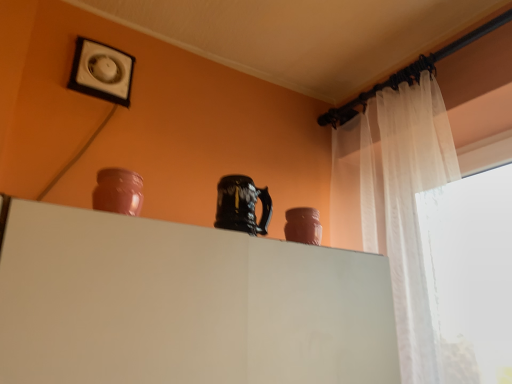
Question: Is matte pink vase at right, which is the 2th vase in front-to-back order, to the right of matte clay vase at upper left, which appears as the second vase when viewed from the back, from the viewer's perspective?

Choices:
 (A) yes
 (B) no

Answer: (A)

Question: Does matte pink vase at right, acting as the 2th vase starting from the top, come in front of matte clay vase at upper left, marked as the 2th vase in a bottom-to-top arrangement?

Choices:
 (A) no
 (B) yes

Answer: (A)

Question: Can you confirm if matte pink vase at right, the 1th vase when ordered from right to left, is shorter than matte clay vase at upper left, which appears as the second vase when viewed from the back?

Choices:
 (A) no
 (B) yes

Answer: (B)

Question: Is matte pink vase at right, which is counted as the 1th vase, starting from the back, not within matte clay vase at upper left, which appears as the second vase when viewed from the back?

Choices:
 (A) yes
 (B) no

Answer: (A)

Question: Is the depth of matte pink vase at right, acting as the 2th vase starting from the top, greater than that of matte clay vase at upper left, which appears as the second vase when viewed from the right?

Choices:
 (A) no
 (B) yes

Answer: (B)

Question: From a real-world perspective, is white glossy vent at upper left physically located above or below matte clay vase at upper left, the first vase when ordered from front to back?

Choices:
 (A) above
 (B) below

Answer: (A)

Question: Is white glossy vent at upper left bigger or smaller than matte clay vase at upper left, which ranks as the 1th vase in left-to-right order?

Choices:
 (A) small
 (B) big

Answer: (B)

Question: Is white glossy vent at upper left taller or shorter than matte clay vase at upper left, the first vase when ordered from front to back?

Choices:
 (A) short
 (B) tall

Answer: (B)

Question: Choose the correct answer: Is white glossy vent at upper left inside matte clay vase at upper left, which appears as the second vase when viewed from the right, or outside it?

Choices:
 (A) outside
 (B) inside

Answer: (A)

Question: Considering the positions of point (314, 243) and point (233, 175), is point (314, 243) closer or farther from the camera than point (233, 175)?

Choices:
 (A) farther
 (B) closer

Answer: (A)

Question: Is matte pink vase at right, arranged as the 1th vase when ordered from the bottom, to the left or to the right of glossy ceramic mug at upper center in the image?

Choices:
 (A) right
 (B) left

Answer: (A)

Question: In terms of height, does matte pink vase at right, acting as the 2th vase starting from the left, look taller or shorter compared to glossy ceramic mug at upper center?

Choices:
 (A) tall
 (B) short

Answer: (B)

Question: From a real-world perspective, is matte pink vase at right, which is the 2th vase in front-to-back order, above or below glossy ceramic mug at upper center?

Choices:
 (A) above
 (B) below

Answer: (B)

Question: Is point (313, 228) closer or farther from the camera than point (134, 195)?

Choices:
 (A) farther
 (B) closer

Answer: (A)

Question: Is matte pink vase at right, arranged as the 1th vase when ordered from the bottom, spatially inside matte clay vase at upper left, arranged as the first vase when viewed from the top, or outside of it?

Choices:
 (A) outside
 (B) inside

Answer: (A)